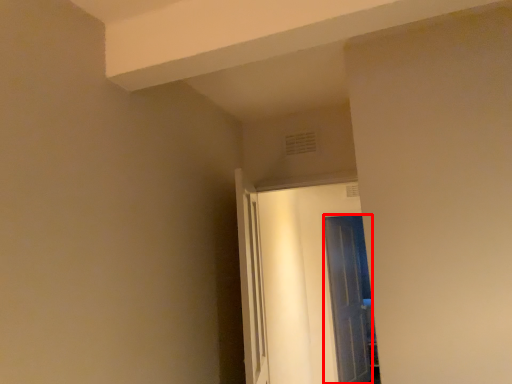
Question: From the image's perspective, what is the correct spatial relationship of door (annotated by the red box) in relation to door?

Choices:
 (A) above
 (B) below

Answer: (B)